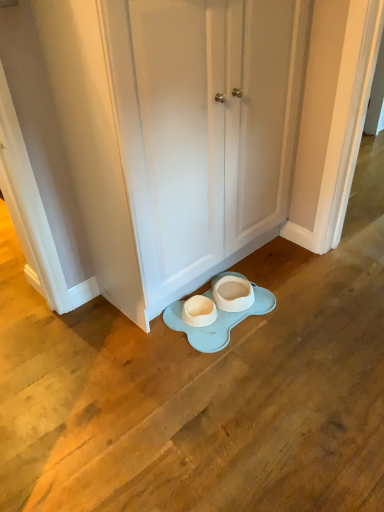
Question: Is white matte porcelain at center situated inside white matte door at center or outside?

Choices:
 (A) outside
 (B) inside

Answer: (A)

Question: From a real-world perspective, is white matte porcelain at center above or below white matte door at center?

Choices:
 (A) above
 (B) below

Answer: (B)

Question: Is white matte porcelain at center wider or thinner than white matte door at center?

Choices:
 (A) wide
 (B) thin

Answer: (A)

Question: Based on their sizes in the image, would you say white matte door at center is bigger or smaller than white matte porcelain at center?

Choices:
 (A) big
 (B) small

Answer: (A)

Question: From a real-world perspective, is white matte door at center above or below white matte porcelain at center?

Choices:
 (A) below
 (B) above

Answer: (B)

Question: Relative to white matte porcelain at center, is white matte door at center in front or behind?

Choices:
 (A) front
 (B) behind

Answer: (A)

Question: From the image's perspective, relative to white matte porcelain at center, is white matte door at center above or below?

Choices:
 (A) below
 (B) above

Answer: (B)